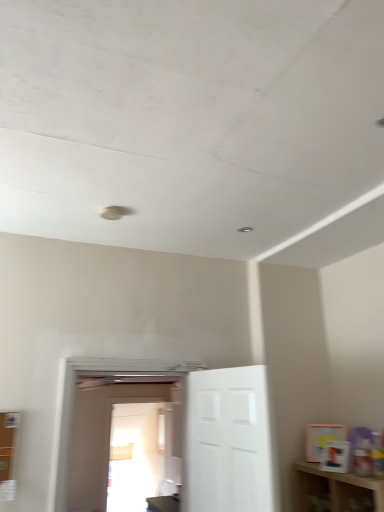
What is the approximate height of white matte door at center, positioned as the second door in left-to-right order?

It is 34.53 inches.

The width and height of the screenshot is (384, 512). Describe the element at coordinates (228, 442) in the screenshot. I see `white matte door at center, positioned as the second door in left-to-right order` at that location.

Image resolution: width=384 pixels, height=512 pixels. What are the coordinates of `white matte door at center, positioned as the second door in left-to-right order` in the screenshot? It's located at (228, 442).

Can you tell me how much white glossy door at center, arranged as the second door when viewed from the right, and transparent glass door at center differ in facing direction?

The angular difference between white glossy door at center, arranged as the second door when viewed from the right, and transparent glass door at center is 0.238 degrees.

Locate an element on the screen. glass door below the white glossy door at center, arranged as the second door when viewed from the right (from a real-world perspective) is located at coordinates (135, 456).

Considering the relative sizes of white glossy door at center, the first door viewed from the left, and transparent glass door at center in the image provided, is white glossy door at center, the first door viewed from the left, taller than transparent glass door at center?

Incorrect, the height of white glossy door at center, the first door viewed from the left, is not larger of that of transparent glass door at center.

Is white glossy door at center, arranged as the second door when viewed from the right, surrounding transparent glass door at center?

Actually, transparent glass door at center is outside white glossy door at center, arranged as the second door when viewed from the right.

Locate an element on the screen. door on the right of the white glossy door at center, the first door viewed from the left is located at coordinates (228, 442).

Is white matte door at center, positioned as the second door in left-to-right order, outside of white glossy door at center, arranged as the second door when viewed from the right?

Yes.

Does white matte door at center, the 1th door in the right-to-left sequence, turn towards white glossy door at center, the first door viewed from the left?

No, white matte door at center, the 1th door in the right-to-left sequence, is not oriented towards white glossy door at center, the first door viewed from the left.

Relative to white matte door at center, the 1th door in the right-to-left sequence, is transparent glass door at center in front or behind?

transparent glass door at center is behind white matte door at center, the 1th door in the right-to-left sequence.

Is transparent glass door at center far away from white matte door at center, positioned as the second door in left-to-right order?

transparent glass door at center is far away from white matte door at center, positioned as the second door in left-to-right order.

Does transparent glass door at center have a greater width compared to white matte door at center, the 1th door in the right-to-left sequence?

Answer: No, transparent glass door at center is not wider than white matte door at center, the 1th door in the right-to-left sequence.

Considering the relative positions of transparent glass door at center and white matte door at center, the 1th door in the right-to-left sequence, in the image provided, is transparent glass door at center to the left or to the right of white matte door at center, the 1th door in the right-to-left sequence,?

In the image, transparent glass door at center appears on the left side of white matte door at center, the 1th door in the right-to-left sequence.

From the image's perspective, is transparent glass door at center located above or below white glossy door at center, arranged as the second door when viewed from the right?

Clearly, from the image's perspective, transparent glass door at center is below white glossy door at center, arranged as the second door when viewed from the right.

In order to click on the 2nd door directly above the transparent glass door at center (from a real-world perspective) in this screenshot , I will do click(100, 436).

In terms of size, does transparent glass door at center appear bigger or smaller than white glossy door at center, the first door viewed from the left?

Clearly, transparent glass door at center is smaller in size than white glossy door at center, the first door viewed from the left.

Looking at their sizes, would you say transparent glass door at center is wider or thinner than white glossy door at center, the first door viewed from the left?

transparent glass door at center is thinner than white glossy door at center, the first door viewed from the left.

Considering the relative sizes of white glossy door at center, the first door viewed from the left, and white matte door at center, the 1th door in the right-to-left sequence, in the image provided, is white glossy door at center, the first door viewed from the left, shorter than white matte door at center, the 1th door in the right-to-left sequence,?

Incorrect, the height of white glossy door at center, the first door viewed from the left, does not fall short of that of white matte door at center, the 1th door in the right-to-left sequence.

Is white glossy door at center, the first door viewed from the left, touching white matte door at center, positioned as the second door in left-to-right order?

They are not placed beside each other.

From the image's perspective, which object appears higher, white glossy door at center, the first door viewed from the left, or white matte door at center, the 1th door in the right-to-left sequence?

white matte door at center, the 1th door in the right-to-left sequence, is shown above in the image.

Which is in front, white glossy door at center, the first door viewed from the left, or white matte door at center, positioned as the second door in left-to-right order?

Positioned in front is white matte door at center, positioned as the second door in left-to-right order.

Based on their positions, is white matte door at center, positioned as the second door in left-to-right order, located to the left or right of transparent glass door at center?

white matte door at center, positioned as the second door in left-to-right order, is positioned on transparent glass door at center's right side.

Who is more distant, white matte door at center, the 1th door in the right-to-left sequence, or transparent glass door at center?

transparent glass door at center.

Considering the sizes of objects white matte door at center, positioned as the second door in left-to-right order, and transparent glass door at center in the image provided, who is taller, white matte door at center, positioned as the second door in left-to-right order, or transparent glass door at center?

Standing taller between the two is transparent glass door at center.

Does white matte door at center, positioned as the second door in left-to-right order, have a greater width compared to transparent glass door at center?

Yes.

Where is `the 1st door counting from the right of the transparent glass door at center`? the 1st door counting from the right of the transparent glass door at center is located at coordinates (100, 436).

Identify the location of door located in front of the white glossy door at center, the first door viewed from the left. (228, 442).

Looking at the image, which one is located further to white matte door at center, positioned as the second door in left-to-right order, transparent glass door at center or white glossy door at center, arranged as the second door when viewed from the right?

transparent glass door at center.

Based on their spatial positions, is white matte door at center, positioned as the second door in left-to-right order, or transparent glass door at center further from white glossy door at center, the first door viewed from the left?

Among the two, white matte door at center, positioned as the second door in left-to-right order, is located further to white glossy door at center, the first door viewed from the left.

From the image, which object appears to be nearer to transparent glass door at center, white glossy door at center, the first door viewed from the left, or white matte door at center, positioned as the second door in left-to-right order?

white glossy door at center, the first door viewed from the left, lies closer to transparent glass door at center than the other object.

Considering their positions, is white glossy door at center, arranged as the second door when viewed from the right, positioned further to white matte door at center, the 1th door in the right-to-left sequence, than transparent glass door at center?

transparent glass door at center is further to white matte door at center, the 1th door in the right-to-left sequence.

Estimate the real-world distances between objects in this image. Which object is closer to transparent glass door at center, white matte door at center, positioned as the second door in left-to-right order, or white glossy door at center, the first door viewed from the left?

white glossy door at center, the first door viewed from the left.

Looking at the image, which one is located further to white glossy door at center, the first door viewed from the left, transparent glass door at center or white matte door at center, the 1th door in the right-to-left sequence?

white matte door at center, the 1th door in the right-to-left sequence, is positioned further to the anchor white glossy door at center, the first door viewed from the left.

The height and width of the screenshot is (512, 384). In order to click on door positioned between white matte door at center, the 1th door in the right-to-left sequence, and transparent glass door at center from near to far in this screenshot , I will do `click(100, 436)`.